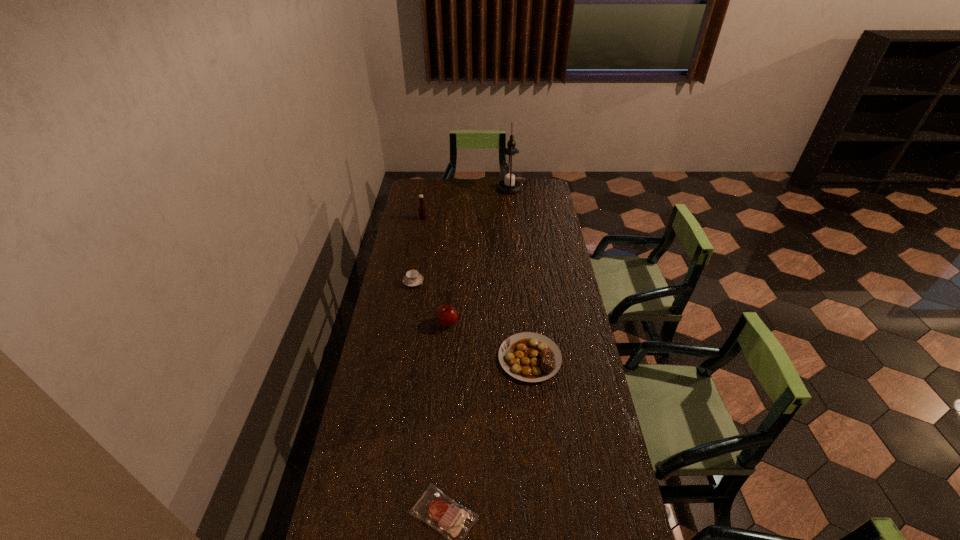
In the image, there is a desktop. Where is `vacant region at the far edge`? vacant region at the far edge is located at coordinates (446, 200).

Identify the location of free space at the left edge. The height and width of the screenshot is (540, 960). (393, 258).

Locate an element on the screen. vacant area at the right edge is located at coordinates (577, 333).

In the image, there is a desktop. Where is `free space at the far left corner`? This screenshot has width=960, height=540. free space at the far left corner is located at coordinates (429, 186).

I want to click on free space that is in between the third farthest object and the third nearest object, so click(430, 302).

Image resolution: width=960 pixels, height=540 pixels. I want to click on free space between the apple and the third farthest object, so click(x=430, y=302).

The image size is (960, 540). Identify the location of free space between the fifth farthest object and the fourth farthest object. (489, 340).

Identify the location of free space between the farthest object and the fourth nearest object. (462, 235).

Find the location of a particular element. This screenshot has height=540, width=960. vacant region between the third tallest object and the Tabasco sauce is located at coordinates (435, 271).

Identify which object is located as the nearest to the teacup. Please provide its 2D coordinates. Your answer should be formatted as a tuple, i.e. [(x, y)], where the tuple contains the x and y coordinates of a point satisfying the conditions above.

[(446, 315)]